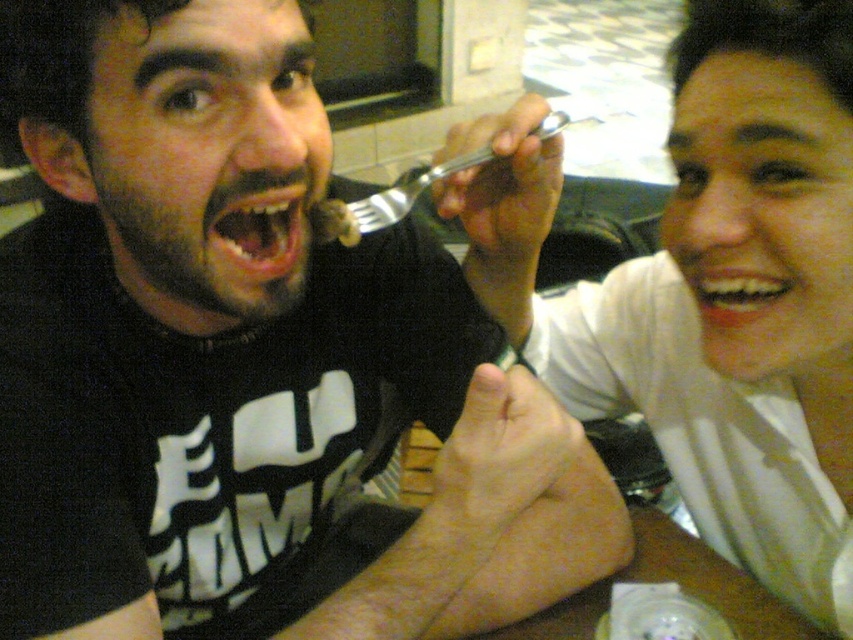
Question: Estimate the real-world distances between objects in this image. Which object is farther from the matte plastic fork at upper center?

Choices:
 (A) pink glossy lips at center
 (B) silver metallic fork at upper center
 (C) white glossy teeth at upper right
 (D) white matte fork at upper right

Answer: (B)

Question: Is wooden table at lower center positioned behind white glossy teeth at upper right?

Choices:
 (A) no
 (B) yes

Answer: (B)

Question: Which object is closer to the camera taking this photo?

Choices:
 (A) matte black fork at upper center
 (B) pink glossy lips at center
 (C) white glossy teeth at upper right
 (D) matte plastic fork at upper center

Answer: (A)

Question: Does matte black fork at upper center have a smaller size compared to matte plastic fork at upper center?

Choices:
 (A) no
 (B) yes

Answer: (A)

Question: Can you confirm if wooden table at lower center is smaller than silver metallic fork at upper center?

Choices:
 (A) no
 (B) yes

Answer: (A)

Question: Among these objects, which one is nearest to the camera?

Choices:
 (A) matte plastic fork at upper center
 (B) pink glossy lips at center
 (C) white glossy teeth at upper right

Answer: (B)